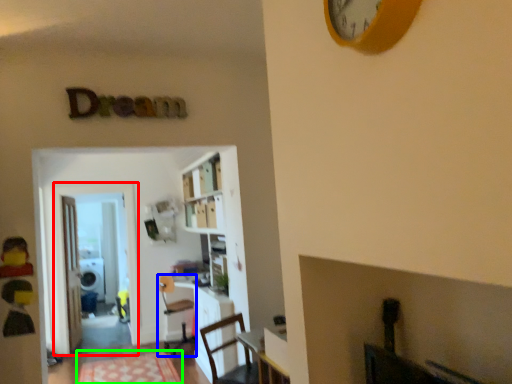
Question: Which object is the closest to the glass door (highlighted by a red box)? Choose among these: chair (highlighted by a blue box) or mat (highlighted by a green box).

Choices:
 (A) chair
 (B) mat

Answer: (A)